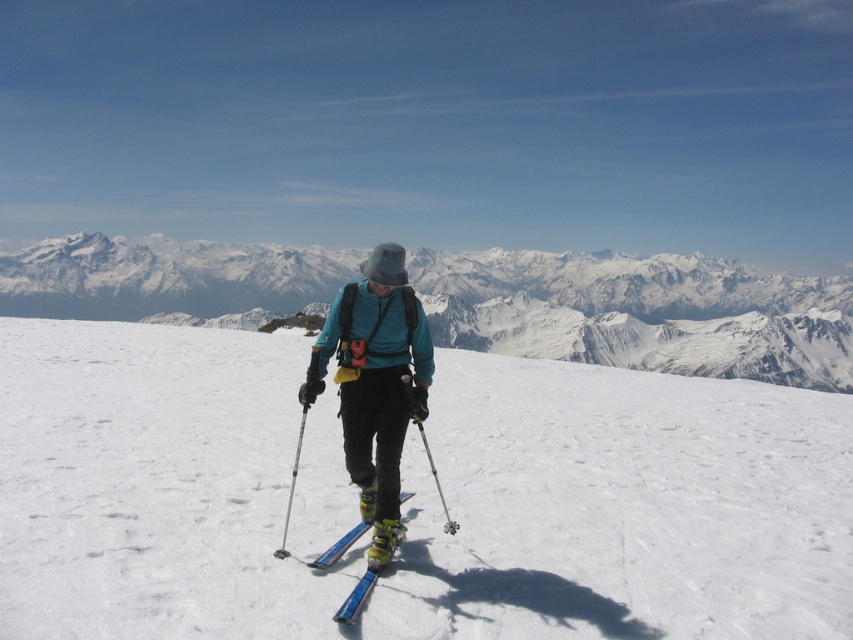
In the scene shown: Who is positioned more to the right, white snow mountain at center or matte blue jacket at center?

white snow mountain at center

Is white snow mountain at center taller than matte blue jacket at center?

Yes.

Who is more forward, (553, 298) or (352, 444)?

Point (352, 444) is more forward.

What are the coordinates of `white snow mountain at center` in the screenshot? It's located at (641, 312).

Is point (527, 252) positioned in front of point (358, 586)?

No, (527, 252) is further to viewer.

Based on the photo, who is higher up, white snow mountain at center or blue metallic ski at center?

Positioned higher is white snow mountain at center.

Between point (640, 285) and point (350, 604), which one is positioned behind?

Point (640, 285)

At what (x,y) coordinates should I click in order to perform the action: click on white snow mountain at center. Please return your answer as a coordinate pair (x, y). This screenshot has height=640, width=853. Looking at the image, I should click on (641, 312).

Can you confirm if white matte snow at center is positioned to the left of blue metallic ski at center?

Correct, you'll find white matte snow at center to the left of blue metallic ski at center.

Locate an element on the screen. white matte snow at center is located at coordinates (412, 497).